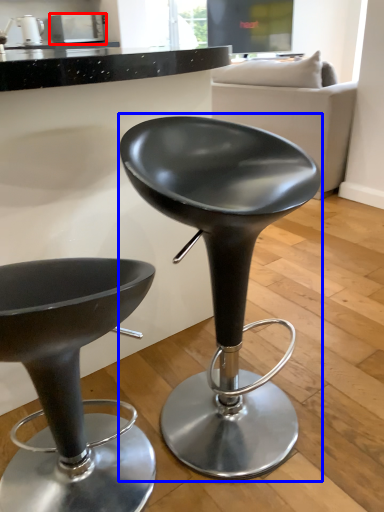
Question: Which of the following is the farthest to the observer, appliance (highlighted by a red box) or chair (highlighted by a blue box)?

Choices:
 (A) appliance
 (B) chair

Answer: (A)